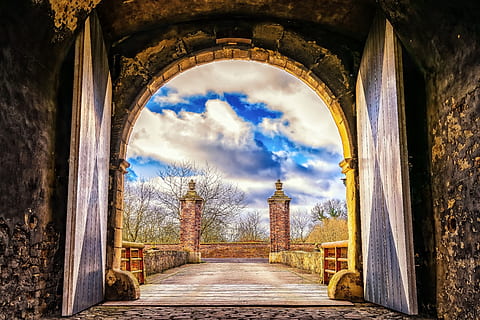
Where is `walls`? walls is located at coordinates (463, 155).